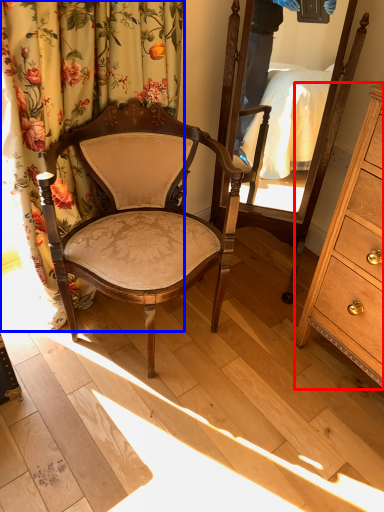
Question: Among these objects, which one is farthest to the camera, cabinetry (highlighted by a red box) or curtain (highlighted by a blue box)?

Choices:
 (A) cabinetry
 (B) curtain

Answer: (B)